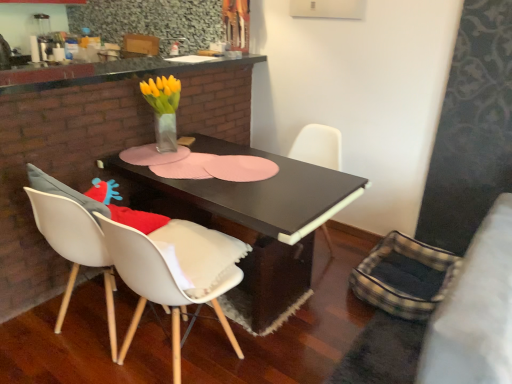
Find the location of `granite countertop at upper center`. granite countertop at upper center is located at coordinates (104, 72).

Describe the element at coordinates (72, 238) in the screenshot. I see `white matte chair at lower left, which appears as the 1th chair when viewed from the left` at that location.

The image size is (512, 384). In order to click on black matte table at center in this screenshot , I will do `click(252, 220)`.

Locate an element on the screen. granite countertop at upper center is located at coordinates (104, 72).

Would you consider granite countertop at upper center to be distant from black matte chair at center, the 2th chair in the front-to-back sequence?

Yes, granite countertop at upper center is far from black matte chair at center, the 2th chair in the front-to-back sequence.

Does granite countertop at upper center appear on the left side of black matte chair at center, the first chair when ordered from back to front?

Indeed, granite countertop at upper center is positioned on the left side of black matte chair at center, the first chair when ordered from back to front.

Looking at the image, does granite countertop at upper center seem bigger or smaller compared to black matte chair at center, the first chair when ordered from back to front?

granite countertop at upper center is smaller than black matte chair at center, the first chair when ordered from back to front.

From the image's perspective, between black matte table at center and white matte chair at lower left, acting as the first chair starting from the front, who is located below?

white matte chair at lower left, acting as the first chair starting from the front.

Considering the relative positions of black matte table at center and white matte chair at lower left, which appears as the second chair when viewed from the right, in the image provided, is black matte table at center behind white matte chair at lower left, which appears as the second chair when viewed from the right,?

Yes, the depth of black matte table at center is greater than that of white matte chair at lower left, which appears as the second chair when viewed from the right.

What are the coordinates of `chair on the left of black matte table at center` in the screenshot? It's located at (72, 238).

Can you confirm if black matte table at center is bigger than white matte chair at lower left, the second chair viewed from the back?

Indeed, black matte table at center has a larger size compared to white matte chair at lower left, the second chair viewed from the back.

In order to click on floral arrangement lying in front of the black matte chair at center, the 2th chair in the front-to-back sequence in this screenshot , I will do `click(163, 109)`.

Can you confirm if black matte chair at center, the first chair when ordered from back to front, is taller than translucent glass vase at center?

Indeed, black matte chair at center, the first chair when ordered from back to front, has a greater height compared to translucent glass vase at center.

Is black matte chair at center, the first chair when ordered from back to front, facing towards translucent glass vase at center?

No, black matte chair at center, the first chair when ordered from back to front, is not turned towards translucent glass vase at center.

From a real-world perspective, is black matte chair at center, the first chair when ordered from back to front, under translucent glass vase at center?

Indeed, from a real-world perspective, black matte chair at center, the first chair when ordered from back to front, is positioned beneath translucent glass vase at center.

In the scene shown: Is white matte chair at lower left, which appears as the 1th chair when viewed from the left, thinner than translucent glass vase at center?

In fact, white matte chair at lower left, which appears as the 1th chair when viewed from the left, might be wider than translucent glass vase at center.

From the image's perspective, is white matte chair at lower left, which appears as the 1th chair when viewed from the left, on top of translucent glass vase at center?

No.

At what (x,y) coordinates should I click in order to perform the action: click on floral arrangement above the white matte chair at lower left, the second chair viewed from the back (from the image's perspective). Please return your answer as a coordinate pair (x, y). Looking at the image, I should click on (163, 109).

Is white matte chair at lower left, acting as the first chair starting from the front, located outside translucent glass vase at center?

white matte chair at lower left, acting as the first chair starting from the front, is positioned outside translucent glass vase at center.

The image size is (512, 384). Identify the location of chair above the black matte table at center (from the image's perspective). (318, 146).

Is black matte table at center facing away from black matte chair at center, acting as the 1th chair starting from the right?

No, black matte chair at center, acting as the 1th chair starting from the right, is not at the back of black matte table at center.

What's the angular difference between black matte table at center and black matte chair at center, acting as the 1th chair starting from the right,'s facing directions?

There is a 86.7-degree angle between the facing directions of black matte table at center and black matte chair at center, acting as the 1th chair starting from the right.

Considering the sizes of objects black matte table at center and black matte chair at center, the first chair when ordered from back to front, in the image provided, who is wider, black matte table at center or black matte chair at center, the first chair when ordered from back to front,?

black matte table at center is wider.

In terms of width, does black matte table at center look wider or thinner when compared to translucent glass vase at center?

Considering their sizes, black matte table at center looks broader than translucent glass vase at center.

From a real-world perspective, which object stands above the other?

In real-world perspective, translucent glass vase at center is above.

Is black matte table at center situated inside translucent glass vase at center or outside?

black matte table at center is located beyond the bounds of translucent glass vase at center.

How different are the orientations of black matte table at center and translucent glass vase at center in degrees?

The angle between the facing direction of black matte table at center and the facing direction of translucent glass vase at center is 0.503 degrees.

From the image's perspective, is white matte chair at lower left, the second chair viewed from the back, on granite countertop at upper center?

No.

Considering the sizes of objects white matte chair at lower left, which appears as the second chair when viewed from the right, and granite countertop at upper center in the image provided, who is taller, white matte chair at lower left, which appears as the second chair when viewed from the right, or granite countertop at upper center?

white matte chair at lower left, which appears as the second chair when viewed from the right.

Is white matte chair at lower left, the second chair viewed from the back, bigger than granite countertop at upper center?

Yes, white matte chair at lower left, the second chair viewed from the back, is bigger than granite countertop at upper center.

Find the location of `chair behind the granite countertop at upper center`. chair behind the granite countertop at upper center is located at coordinates (318, 146).

The image size is (512, 384). I want to click on chair in front of the black matte table at center, so click(72, 238).

From the image, which object appears to be nearer to translucent glass vase at center, white matte chair at lower left, which appears as the 1th chair when viewed from the left, or black matte table at center?

black matte table at center.

Based on their spatial positions, is translucent glass vase at center or black matte chair at center, the first chair when ordered from back to front, further from black matte table at center?

Based on the image, translucent glass vase at center appears to be further to black matte table at center.

Based on their spatial positions, is translucent glass vase at center or granite countertop at upper center closer to white matte chair at lower left, the second chair viewed from the back?

Based on the image, translucent glass vase at center appears to be nearer to white matte chair at lower left, the second chair viewed from the back.

Estimate the real-world distances between objects in this image. Which object is further from black matte chair at center, acting as the 2th chair starting from the left, granite countertop at upper center or white matte chair at lower left, acting as the first chair starting from the front?

Based on the image, granite countertop at upper center appears to be further to black matte chair at center, acting as the 2th chair starting from the left.

Based on their spatial positions, is black matte table at center or black matte chair at center, the 2th chair in the front-to-back sequence, further from white matte chair at lower left, the second chair viewed from the back?

The object further to white matte chair at lower left, the second chair viewed from the back, is black matte chair at center, the 2th chair in the front-to-back sequence.

Estimate the real-world distances between objects in this image. Which object is closer to granite countertop at upper center, translucent glass vase at center or black matte chair at center, acting as the 1th chair starting from the right?

translucent glass vase at center is closer to granite countertop at upper center.

Estimate the real-world distances between objects in this image. Which object is closer to translucent glass vase at center, granite countertop at upper center or black matte table at center?

black matte table at center is positioned closer to the anchor translucent glass vase at center.

Estimate the real-world distances between objects in this image. Which object is further from granite countertop at upper center, black matte chair at center, the 2th chair in the front-to-back sequence, or black matte table at center?

black matte table at center.

Identify the location of table positioned between white matte chair at lower left, which appears as the 1th chair when viewed from the left, and black matte chair at center, the 2th chair in the front-to-back sequence, from near to far. The image size is (512, 384). (252, 220).

Image resolution: width=512 pixels, height=384 pixels. Find the location of `table between granite countertop at upper center and white matte chair at lower left, which appears as the second chair when viewed from the right, in the vertical direction`. table between granite countertop at upper center and white matte chair at lower left, which appears as the second chair when viewed from the right, in the vertical direction is located at coordinates (252, 220).

Find the location of `floral arrangement between granite countertop at upper center and white matte chair at lower left, acting as the first chair starting from the front, in the vertical direction`. floral arrangement between granite countertop at upper center and white matte chair at lower left, acting as the first chair starting from the front, in the vertical direction is located at coordinates (163, 109).

Where is `chair between granite countertop at upper center and black matte table at center in the vertical direction`? The height and width of the screenshot is (384, 512). chair between granite countertop at upper center and black matte table at center in the vertical direction is located at coordinates (318, 146).